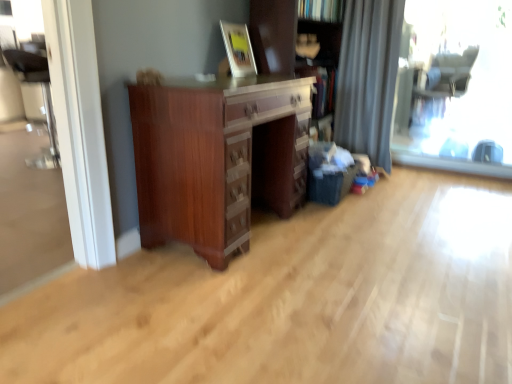
Image resolution: width=512 pixels, height=384 pixels. Identify the location of gray fabric curtain at right. (368, 77).

Looking at this image, who is taller, transparent glass window at right or wooden bookcase at center?

Standing taller between the two is transparent glass window at right.

In the scene shown: Is transparent glass window at right turned away from wooden bookcase at center?

transparent glass window at right does not have its back to wooden bookcase at center.

From a real-world perspective, which object rests below the other?

From a 3D spatial view, transparent glass window at right is below.

How far apart are transparent glass window at right and wooden bookcase at center?

transparent glass window at right and wooden bookcase at center are 8.47 feet apart.

Is transparent glass window at right facing towards gray fabric curtain at right?

No, transparent glass window at right is not oriented towards gray fabric curtain at right.

Where is `curtain above the transparent glass window at right (from the image's perspective)`? curtain above the transparent glass window at right (from the image's perspective) is located at coordinates (368, 77).

Considering the relative positions of transparent glass window at right and gray fabric curtain at right in the image provided, is transparent glass window at right in front of gray fabric curtain at right?

Yes, it is.

Would you say wooden bookcase at center is a long distance from transparent glass window at right?

Yes, wooden bookcase at center is far from transparent glass window at right.

What's the angular difference between wooden bookcase at center and transparent glass window at right's facing directions?

There is a 90.6-degree angle between the facing directions of wooden bookcase at center and transparent glass window at right.

Does wooden bookcase at center contain transparent glass window at right?

That's incorrect, transparent glass window at right is not inside wooden bookcase at center.

From the image's perspective, which one is positioned higher, wooden bookcase at center or transparent glass window at right?

transparent glass window at right is shown above in the image.

Is mahogany wood chest of drawers at center bigger than gray fabric curtain at right?

Yes.

Looking at this image, is the position of mahogany wood chest of drawers at center less distant than that of gray fabric curtain at right?

Yes, it is.

Is point (217, 221) closer or farther from the camera than point (369, 17)?

Point (217, 221) is positioned closer to the camera compared to point (369, 17).

Locate an element on the screen. the chest of drawers that is below the gray fabric curtain at right (from the image's perspective) is located at coordinates (213, 158).

Is mahogany wood chest of drawers at center at the left side of wooden bookcase at center?

Indeed, mahogany wood chest of drawers at center is positioned on the left side of wooden bookcase at center.

Is point (144, 144) positioned after point (253, 41)?

No, it is not.

Which of these two, mahogany wood chest of drawers at center or wooden bookcase at center, stands shorter?

mahogany wood chest of drawers at center is shorter.

From a real-world perspective, between mahogany wood chest of drawers at center and wooden bookcase at center, who is vertically lower?

mahogany wood chest of drawers at center.

Could you tell me if gray fabric curtain at right is facing wooden picture frame at upper center?

No, gray fabric curtain at right is not facing towards wooden picture frame at upper center.

In the image, is gray fabric curtain at right on the left side or the right side of wooden picture frame at upper center?

From the image, it's evident that gray fabric curtain at right is to the right of wooden picture frame at upper center.

Is there a large distance between gray fabric curtain at right and wooden picture frame at upper center?

That's right, there is a large distance between gray fabric curtain at right and wooden picture frame at upper center.

Is gray fabric curtain at right shorter than wooden picture frame at upper center?

No.

From a real-world perspective, is wooden picture frame at upper center physically below transparent glass window at right?

Actually, wooden picture frame at upper center is physically above transparent glass window at right in the real world.

Is wooden picture frame at upper center completely or partially outside of transparent glass window at right?

Yes, wooden picture frame at upper center is not within transparent glass window at right.

How different are the orientations of wooden picture frame at upper center and transparent glass window at right in degrees?

They differ by 81.8 degrees in their facing directions.

Where is `window screen that appears below the wooden picture frame at upper center (from the image's perspective)`? window screen that appears below the wooden picture frame at upper center (from the image's perspective) is located at coordinates (455, 86).

You are a GUI agent. You are given a task and a screenshot of the screen. Output one action in this format:
    pyautogui.click(x=<x>, y=<y>)
    Task: Click on the bookcase on the left side of transparent glass window at right
    
    Given the screenshot: What is the action you would take?
    pyautogui.click(x=289, y=38)

Where is `curtain above the transparent glass window at right (from the image's perspective)`? This screenshot has width=512, height=384. curtain above the transparent glass window at right (from the image's perspective) is located at coordinates (368, 77).

Consider the image. Based on their spatial positions, is mahogany wood chest of drawers at center or wooden picture frame at upper center closer to transparent glass window at right?

Among the two, mahogany wood chest of drawers at center is located nearer to transparent glass window at right.

From the picture: Which object lies further to the anchor point transparent glass window at right, gray fabric curtain at right or wooden picture frame at upper center?

wooden picture frame at upper center is further to transparent glass window at right.

Which object lies nearer to the anchor point wooden bookcase at center, gray fabric curtain at right or mahogany wood chest of drawers at center?

Among the two, gray fabric curtain at right is located nearer to wooden bookcase at center.

Which object lies further to the anchor point wooden picture frame at upper center, transparent glass window at right or gray fabric curtain at right?

transparent glass window at right lies further to wooden picture frame at upper center than the other object.

Which object lies further to the anchor point gray fabric curtain at right, mahogany wood chest of drawers at center or wooden bookcase at center?

mahogany wood chest of drawers at center.

Looking at the image, which one is located closer to wooden bookcase at center, mahogany wood chest of drawers at center or gray fabric curtain at right?

The object closer to wooden bookcase at center is gray fabric curtain at right.

Looking at the image, which one is located closer to gray fabric curtain at right, wooden bookcase at center or mahogany wood chest of drawers at center?

wooden bookcase at center lies closer to gray fabric curtain at right than the other object.

Which object lies further to the anchor point wooden picture frame at upper center, gray fabric curtain at right or mahogany wood chest of drawers at center?

gray fabric curtain at right.

The image size is (512, 384). What are the coordinates of `picture frame between mahogany wood chest of drawers at center and wooden bookcase at center in the front-back direction` in the screenshot? It's located at 238,49.

Find the location of a particular element. Image resolution: width=512 pixels, height=384 pixels. curtain situated between mahogany wood chest of drawers at center and transparent glass window at right from left to right is located at coordinates (368, 77).

This screenshot has height=384, width=512. Identify the location of bookcase between wooden picture frame at upper center and transparent glass window at right. (289, 38).

You are a GUI agent. You are given a task and a screenshot of the screen. Output one action in this format:
    pyautogui.click(x=<x>, y=<y>)
    Task: Click on the curtain between wooden picture frame at upper center and transparent glass window at right in the horizontal direction
    
    Given the screenshot: What is the action you would take?
    pyautogui.click(x=368, y=77)